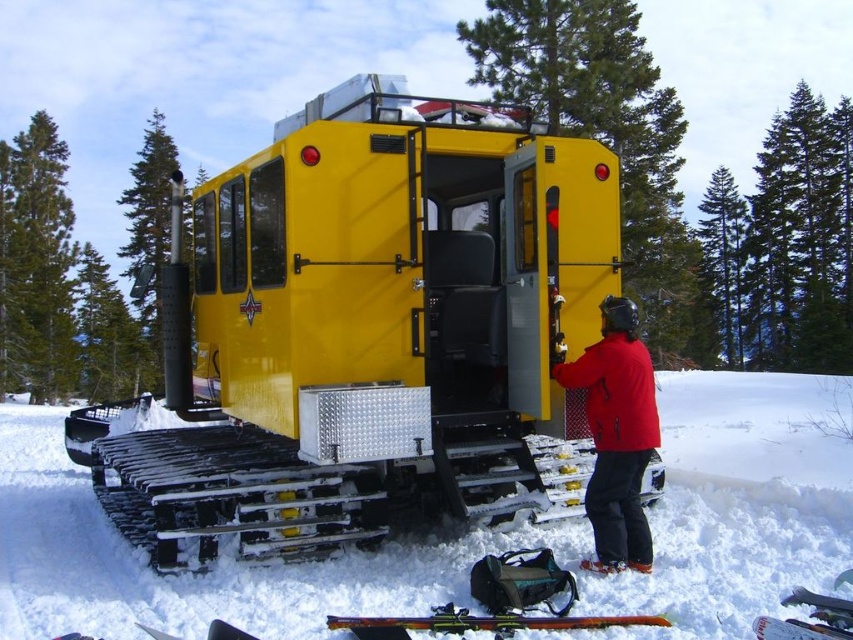
Is yellow metallic train car at center further to the viewer compared to red matte jacket at center?

Yes, it is.

Can you confirm if yellow metallic train car at center is thinner than red matte jacket at center?

Yes, yellow metallic train car at center is thinner than red matte jacket at center.

Between point (512, 260) and point (643, 438), which one is positioned in front?

Point (643, 438) is more forward.

Where is `yellow metallic train car at center`? This screenshot has height=640, width=853. yellow metallic train car at center is located at coordinates (364, 326).

In the scene shown: Is yellow metallic train car at center positioned at the back of white powdery snow at center?

Yes.

Does point (384, 292) come behind point (660, 394)?

No, (384, 292) is closer to viewer.

Image resolution: width=853 pixels, height=640 pixels. In order to click on yellow metallic train car at center in this screenshot , I will do pos(364,326).

Is white powdery snow at center taller than red matte jacket at center?

No, white powdery snow at center is not taller than red matte jacket at center.

Between white powdery snow at center and red matte jacket at center, which one is positioned lower?

white powdery snow at center

Identify the location of white powdery snow at center. (740, 502).

You are a GUI agent. You are given a task and a screenshot of the screen. Output one action in this format:
    pyautogui.click(x=<x>, y=<y>)
    Task: Click on the white powdery snow at center
    The height and width of the screenshot is (640, 853).
    Given the screenshot: What is the action you would take?
    pyautogui.click(x=740, y=502)